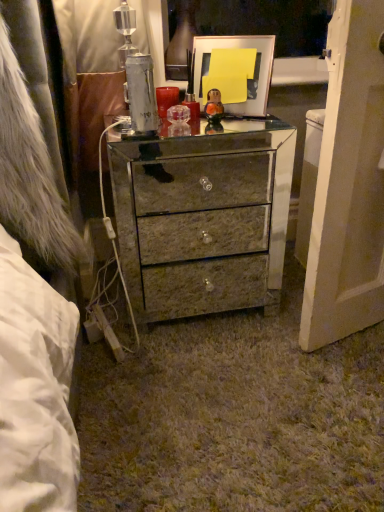
Question: From a real-world perspective, is mirrored glass chest of drawers at center physically located above or below metallic gold picture frame at upper center?

Choices:
 (A) above
 (B) below

Answer: (B)

Question: Is mirrored glass chest of drawers at center in front of or behind metallic gold picture frame at upper center in the image?

Choices:
 (A) behind
 (B) front

Answer: (B)

Question: Looking at the image, does mirrored glass chest of drawers at center seem bigger or smaller compared to metallic gold picture frame at upper center?

Choices:
 (A) big
 (B) small

Answer: (A)

Question: From the image's perspective, is metallic gold picture frame at upper center positioned above or below mirrored glass chest of drawers at center?

Choices:
 (A) below
 (B) above

Answer: (B)

Question: Considering the positions of point (241, 113) and point (281, 266), is point (241, 113) closer or farther from the camera than point (281, 266)?

Choices:
 (A) closer
 (B) farther

Answer: (A)

Question: In terms of height, does metallic gold picture frame at upper center look taller or shorter compared to mirrored glass chest of drawers at center?

Choices:
 (A) tall
 (B) short

Answer: (B)

Question: In the image, is metallic gold picture frame at upper center positioned in front of or behind mirrored glass chest of drawers at center?

Choices:
 (A) behind
 (B) front

Answer: (A)